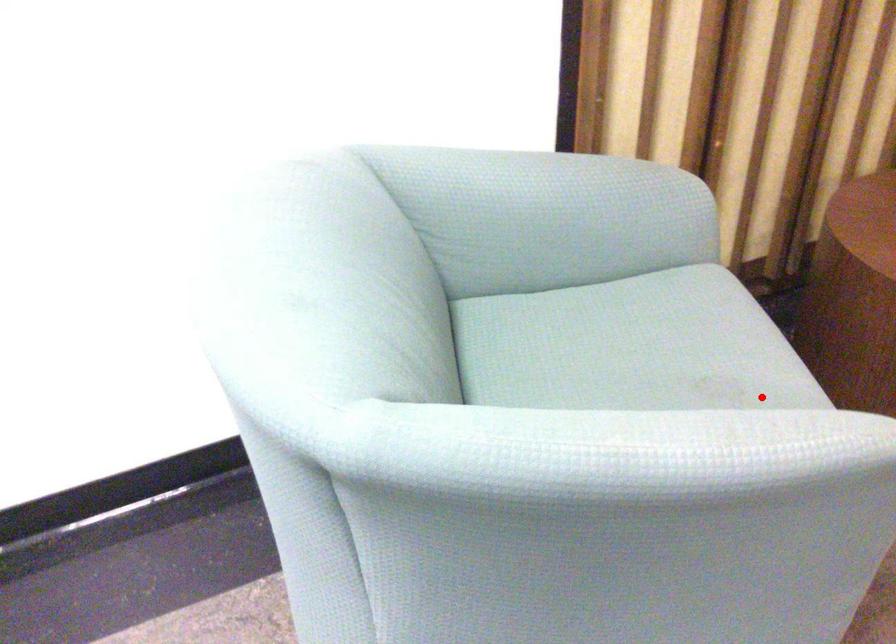
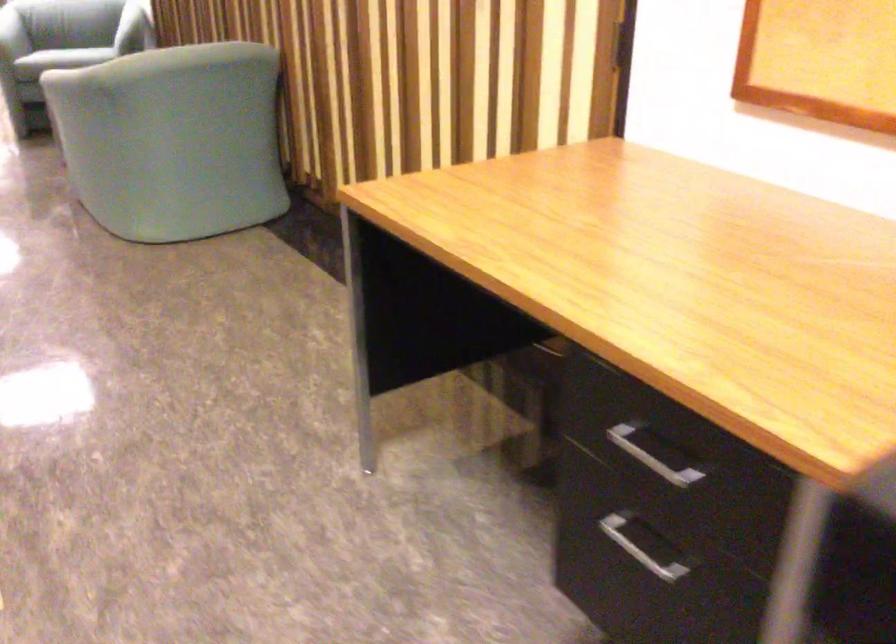
Question: I am providing you with two images of the same scene from different viewpoints. Image1 has a red point marked. In image2, the corresponding 3D location appears at what relative position? Reply with the corresponding letter.

Choices:
 (A) Closer
 (B) Farther

Answer: (B)